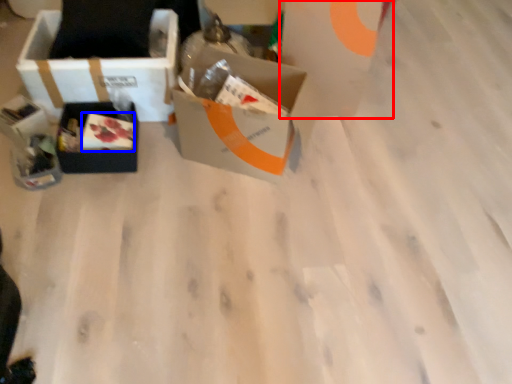
Question: Which object is further to the camera taking this photo, cardboard box (highlighted by a red box) or food (highlighted by a blue box)?

Choices:
 (A) cardboard box
 (B) food

Answer: (B)